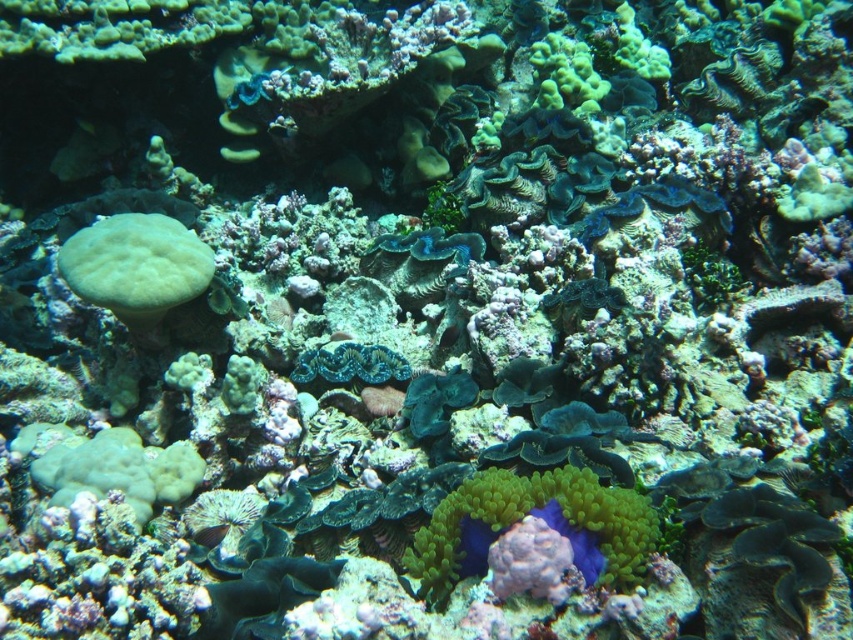
Looking at this image, you are a scuba diver swimming in the coral reef. You see two points marked in the scene. Which point is closer to you, point (x=563, y=508) or point (x=106, y=259)?

Point (x=563, y=508) is in front of point (x=106, y=259), so it is closer to you.